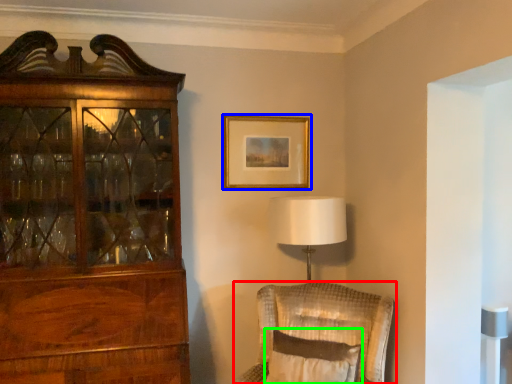
Question: Considering the real-world distances, which object is farthest from chair (highlighted by a red box)? picture frame (highlighted by a blue box) or pillow (highlighted by a green box)?

Choices:
 (A) picture frame
 (B) pillow

Answer: (A)